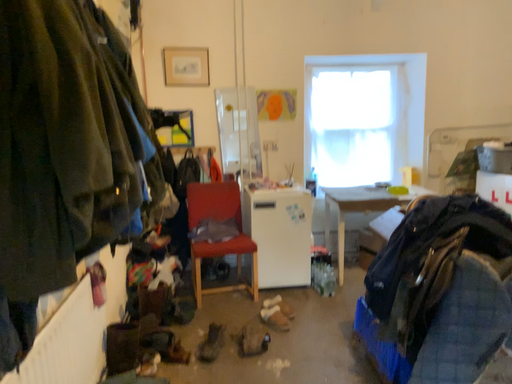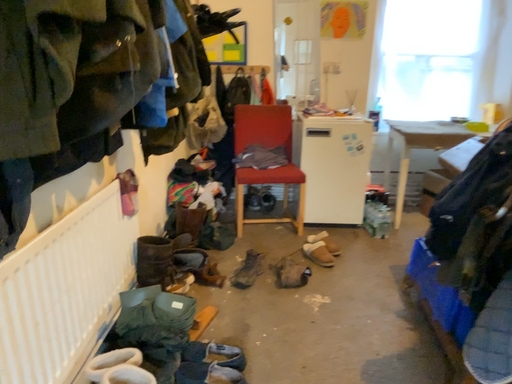
Question: How did the camera likely rotate when shooting the video?

Choices:
 (A) rotated left
 (B) rotated right

Answer: (A)